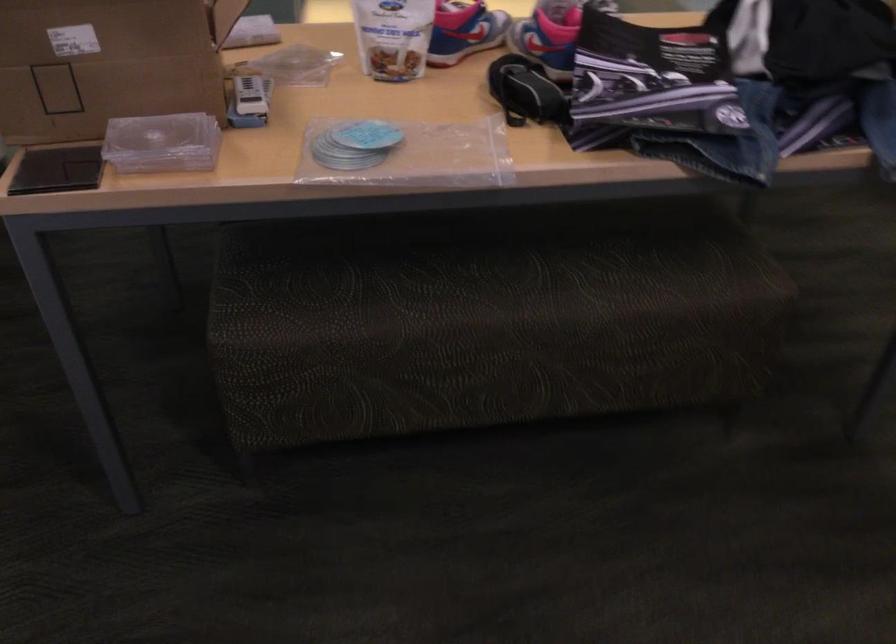
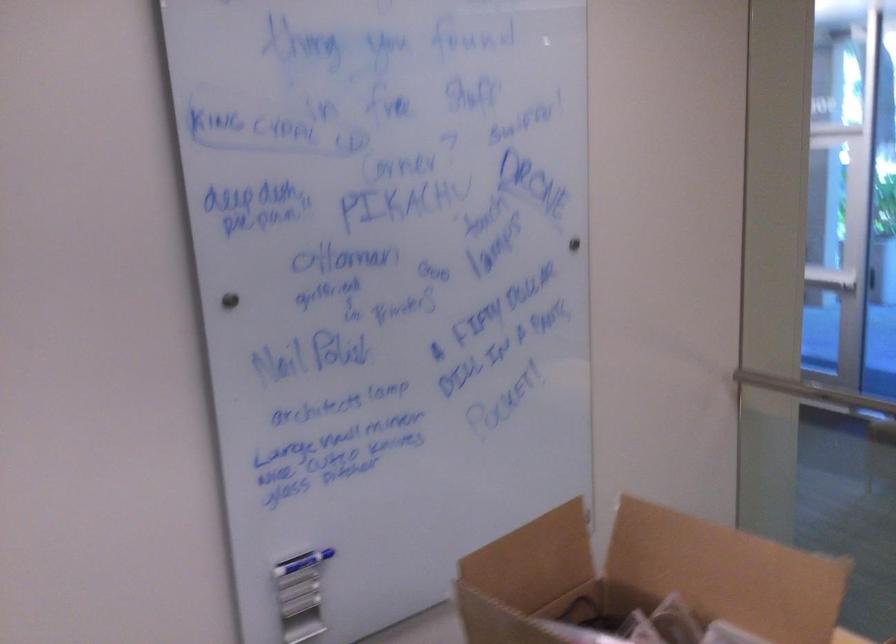
Question: The camera is either moving clockwise (left) or counter-clockwise (right) around the object. The first image is from the beginning of the video and the second image is from the end. Is the camera moving left or right when shooting the video?

Choices:
 (A) Left
 (B) Right

Answer: (B)